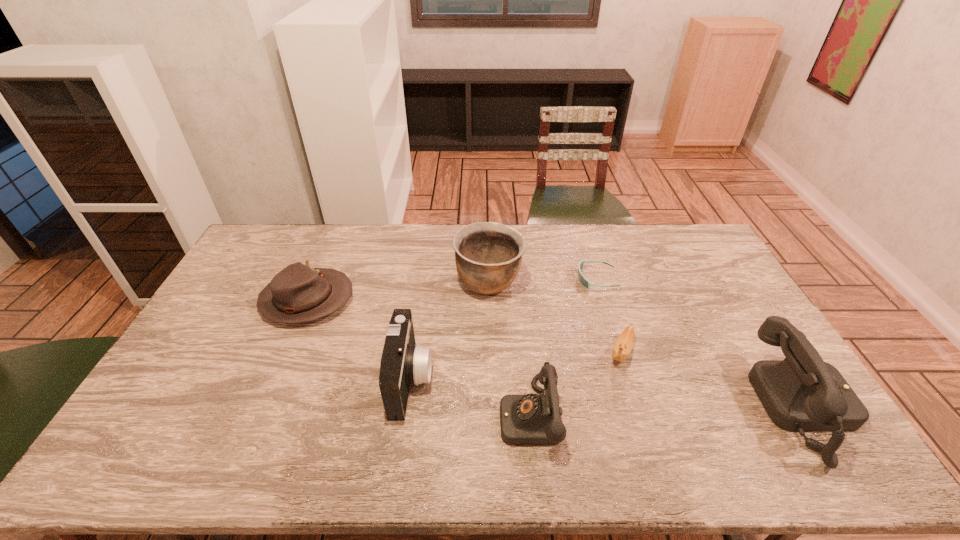
In order to click on free space between the banana and the camcorder in this screenshot , I will do `click(516, 366)`.

Locate an element on the screen. The width and height of the screenshot is (960, 540). vacant area that lies between the sixth tallest object and the camcorder is located at coordinates (516, 366).

The image size is (960, 540). I want to click on free space between the banana and the second object from left to right, so click(x=516, y=366).

Where is `free space between the banana and the goggles`? This screenshot has width=960, height=540. free space between the banana and the goggles is located at coordinates (609, 316).

In order to click on empty space that is in between the taller telephone and the banana in this screenshot , I will do `click(714, 380)`.

In order to click on vacant area that lies between the banana and the camcorder in this screenshot , I will do (516, 366).

I want to click on vacant space that's between the sixth object from right to left and the taller telephone, so (x=609, y=394).

Identify the location of free space between the second shortest object and the leftmost object. The image size is (960, 540). (465, 326).

This screenshot has width=960, height=540. In order to click on free space that is in between the goggles and the rightmost object in this screenshot , I will do `click(702, 343)`.

Where is `free spot between the camcorder and the rightmost object`? Image resolution: width=960 pixels, height=540 pixels. free spot between the camcorder and the rightmost object is located at coordinates (609, 394).